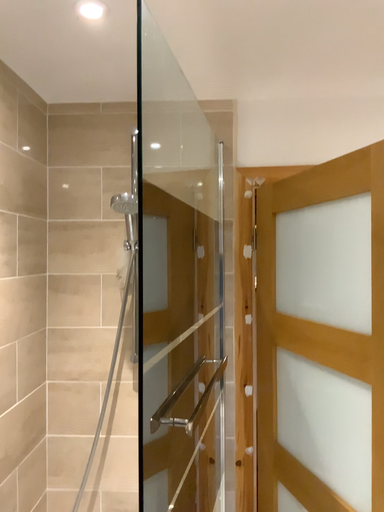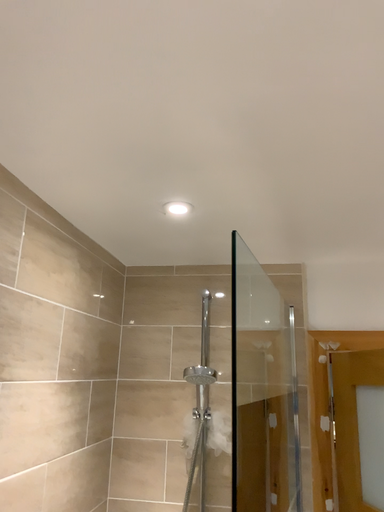
Question: Which way did the camera rotate in the video?

Choices:
 (A) rotated left
 (B) rotated right

Answer: (A)